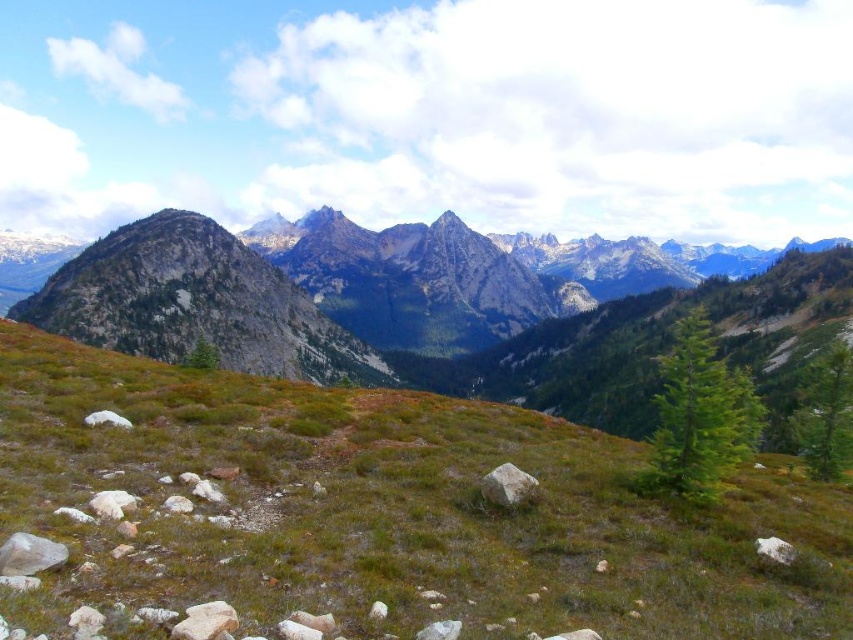
Question: Which object is closer to the camera taking this photo?

Choices:
 (A) white smooth rock at lower left
 (B) white smooth rock at lower right
 (C) smooth gray rock at center
 (D) green grassy at center

Answer: (D)

Question: Observing the image, what is the correct spatial positioning of green grassy at center in reference to smooth gray rock at center?

Choices:
 (A) right
 (B) left

Answer: (B)

Question: Which point appears closest to the camera in this image?

Choices:
 (A) (0, 568)
 (B) (502, 477)
 (C) (206, 451)

Answer: (A)

Question: Is the position of green grassy at center more distant than that of white smooth rock at lower left?

Choices:
 (A) no
 (B) yes

Answer: (A)

Question: Which point appears farthest from the camera in this image?

Choices:
 (A) (502, 492)
 (B) (755, 540)
 (C) (18, 532)
 (D) (505, 433)

Answer: (D)

Question: Is gray rough rock at lower left to the left of smooth gray rock at center from the viewer's perspective?

Choices:
 (A) no
 (B) yes

Answer: (B)